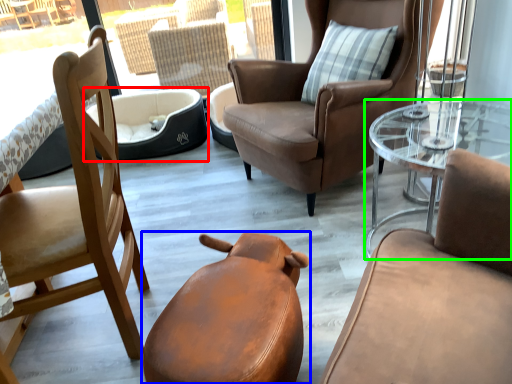
Question: Considering the real-world distances, which object is closest to dog bed (highlighted by a red box)? chair (highlighted by a blue box) or coffee table (highlighted by a green box).

Choices:
 (A) chair
 (B) coffee table

Answer: (B)